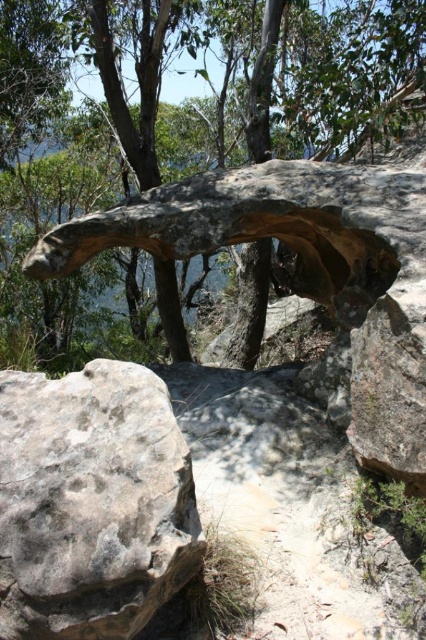
You are a hiker who wants to place a small backpack on the gray rough rock at lower left. Can you fit it there without it falling off the brown rough tree trunk at center?

The gray rough rock at lower left is smaller than the brown rough tree trunk at center. Since the rock is smaller, it might not have enough space to securely hold the backpack, so placing it there could risk it falling off.

You are standing at the center of the scene and want to place a small flag exactly at the location of the brown rough rock at center. According to the coordinates provided, where should you place the flag?

You should place the flag at point coordinates (339,74) where the brown rough rock at center is located.

You are a hiker who wants to place a small backpack between the brown rough rock at center and the gray rough rock at lower left. Based on their positions, which rock should you position the backpack closer to if you want it to be closer to the left side of the scene?

The gray rough rock at lower left is positioned to the left of the brown rough rock at center, so placing the backpack closer to the gray rough rock at lower left would make it closer to the left side of the scene.